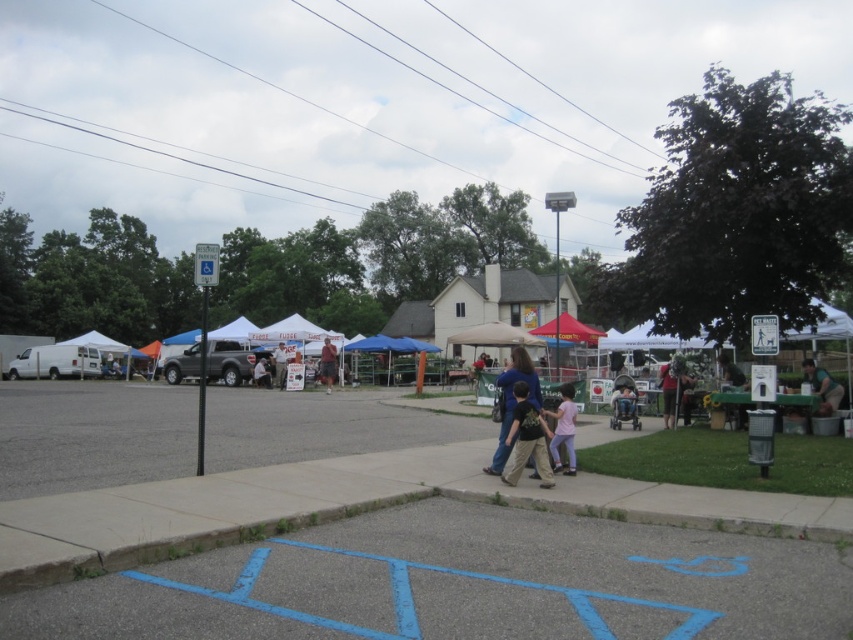
Question: Which is nearer to the pink cotton shirt at center?

Choices:
 (A) dark brown cotton shirt at center
 (B) matte green shirt at center
 (C) blue denim jeans at center
 (D) khaki cotton shorts at center

Answer: (C)

Question: Is blue painted asphalt at lower center thinner than dark brown cotton shirt at center?

Choices:
 (A) no
 (B) yes

Answer: (A)

Question: Considering the real-world distances, which object is closest to the pink cotton shirt at center?

Choices:
 (A) blue denim jeans at center
 (B) dark brown cotton shirt at center
 (C) matte green shirt at center
 (D) blue painted asphalt at lower center

Answer: (A)

Question: Estimate the real-world distances between objects in this image. Which object is farther from the khaki cotton shorts at center?

Choices:
 (A) blue denim jeans at center
 (B) matte green shirt at center
 (C) blue painted asphalt at lower center

Answer: (C)

Question: Can you confirm if blue denim jeans at center is smaller than khaki cotton shorts at center?

Choices:
 (A) no
 (B) yes

Answer: (A)

Question: Can you confirm if dark brown cotton shirt at center is smaller than matte green shirt at center?

Choices:
 (A) yes
 (B) no

Answer: (B)